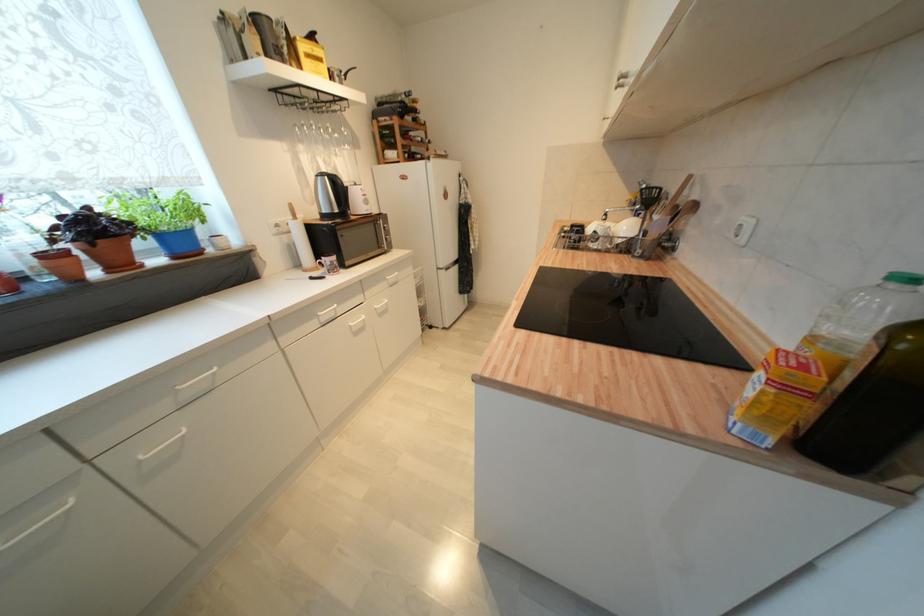
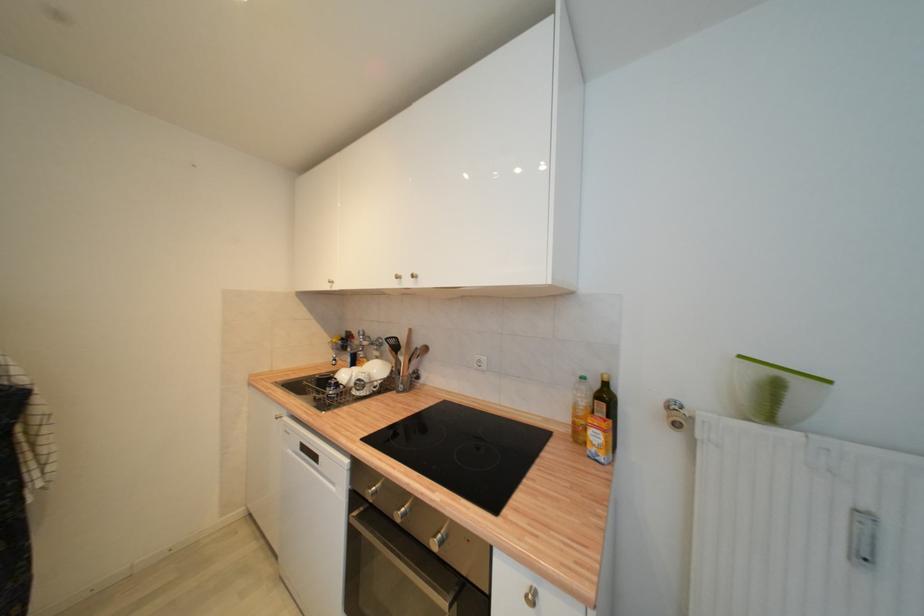
The point at (600, 233) is marked in the first image. Where is the corresponding point in the second image?

(363, 382)